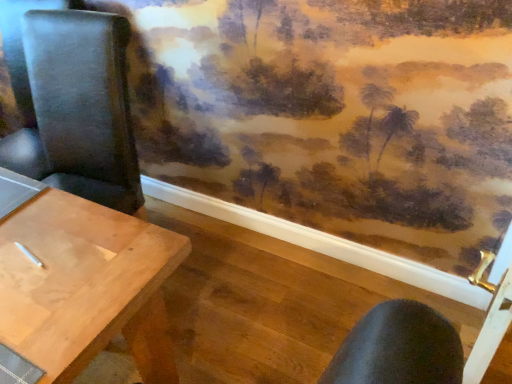
Identify the location of light brown wood table at left. This screenshot has width=512, height=384. (82, 281).

This screenshot has height=384, width=512. Describe the element at coordinates (82, 281) in the screenshot. I see `light brown wood table at left` at that location.

Locate an element on the screen. black leather chair at left is located at coordinates (78, 109).

This screenshot has height=384, width=512. What do you see at coordinates (78, 109) in the screenshot?
I see `black leather chair at left` at bounding box center [78, 109].

Image resolution: width=512 pixels, height=384 pixels. I want to click on light brown wood table at left, so click(82, 281).

Between light brown wood table at left and black leather chair at left, which one appears on the left side from the viewer's perspective?

Positioned to the left is light brown wood table at left.

Which is behind, light brown wood table at left or black leather chair at left?

black leather chair at left is more distant.

Considering the positions of points (48, 383) and (124, 77), is point (48, 383) farther from camera compared to point (124, 77)?

No.

From the image's perspective, is light brown wood table at left below black leather chair at left?

Indeed, from the image's perspective, light brown wood table at left is shown beneath black leather chair at left.

From a real-world perspective, is light brown wood table at left over black leather chair at left?

No, from a real-world perspective, light brown wood table at left is not over black leather chair at left

Looking at this image, considering the sizes of objects light brown wood table at left and black leather chair at left in the image provided, who is thinner, light brown wood table at left or black leather chair at left?

Thinner between the two is light brown wood table at left.

Which of these two, light brown wood table at left or black leather chair at left, stands taller?

black leather chair at left.

Between light brown wood table at left and black leather chair at left, which one has smaller size?

With smaller size is black leather chair at left.

Is light brown wood table at left inside or outside of black leather chair at left?

Result: light brown wood table at left exists outside the volume of black leather chair at left.

Is light brown wood table at left in contact with black leather chair at left?

There is a gap between light brown wood table at left and black leather chair at left.

Is light brown wood table at left positioned with its back to black leather chair at left?

Yes, light brown wood table at left is facing away from black leather chair at left.

In the scene shown: How far apart are light brown wood table at left and black leather chair at left?

23.45 inches.

Where is `chair above the light brown wood table at left (from a real-world perspective)`? The width and height of the screenshot is (512, 384). chair above the light brown wood table at left (from a real-world perspective) is located at coordinates (78, 109).

Is black leather chair at left at the right side of light brown wood table at left?

Correct, you'll find black leather chair at left to the right of light brown wood table at left.

Is black leather chair at left further to the viewer compared to light brown wood table at left?

Yes, black leather chair at left is further from the viewer.

Is point (83, 87) closer to camera compared to point (12, 192)?

No.

From the image's perspective, who appears lower, black leather chair at left or light brown wood table at left?

light brown wood table at left is shown below in the image.

From a real-world perspective, which is physically above, black leather chair at left or light brown wood table at left?

black leather chair at left.

Considering the sizes of black leather chair at left and light brown wood table at left in the image, is black leather chair at left wider or thinner than light brown wood table at left?

black leather chair at left is wider than light brown wood table at left.

Can you confirm if black leather chair at left is taller than light brown wood table at left?

Yes.

Which of these two, black leather chair at left or light brown wood table at left, is smaller?

black leather chair at left.

Is black leather chair at left outside of light brown wood table at left?

Yes.

Is black leather chair at left placed right next to light brown wood table at left?

No, black leather chair at left is not making contact with light brown wood table at left.

Looking at this image, is light brown wood table at left at the back of black leather chair at left?

No.

Where is `chair on the right of light brown wood table at left`? chair on the right of light brown wood table at left is located at coordinates (78, 109).

The height and width of the screenshot is (384, 512). Find the location of `chair that is above the light brown wood table at left (from a real-world perspective)`. chair that is above the light brown wood table at left (from a real-world perspective) is located at coordinates (78, 109).

Identify the location of table on the left of black leather chair at left. (82, 281).